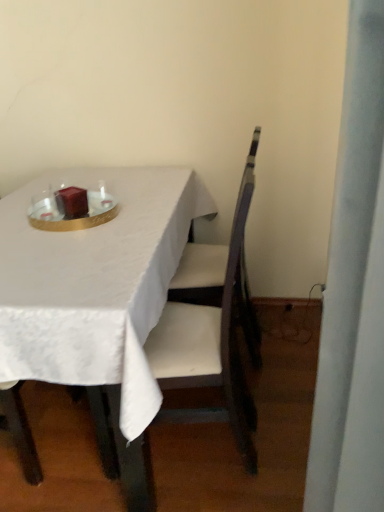
Question: Considering the positions of matte brown candle at center and shiny gold tray at center in the image, is matte brown candle at center taller or shorter than shiny gold tray at center?

Choices:
 (A) tall
 (B) short

Answer: (A)

Question: Considering their positions, is matte brown candle at center located in front of or behind shiny gold tray at center?

Choices:
 (A) front
 (B) behind

Answer: (B)

Question: Which object is positioned closest to the white fabric table at center?

Choices:
 (A) matte brown candle at center
 (B) shiny gold tray at center
 (C) wooden chair at center

Answer: (B)

Question: Which object is the farthest from the matte brown candle at center?

Choices:
 (A) shiny gold tray at center
 (B) white fabric table at center
 (C) wooden chair at center

Answer: (C)